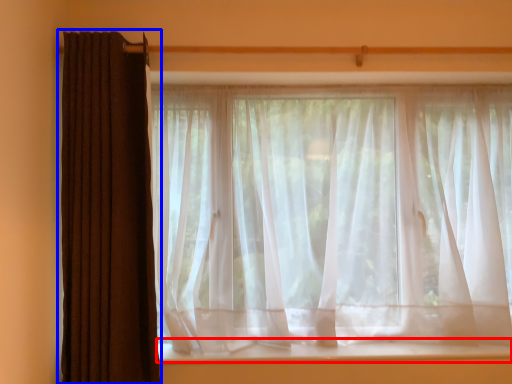
Question: Which object is closer to the camera taking this photo, window sill (highlighted by a red box) or curtain (highlighted by a blue box)?

Choices:
 (A) window sill
 (B) curtain

Answer: (B)